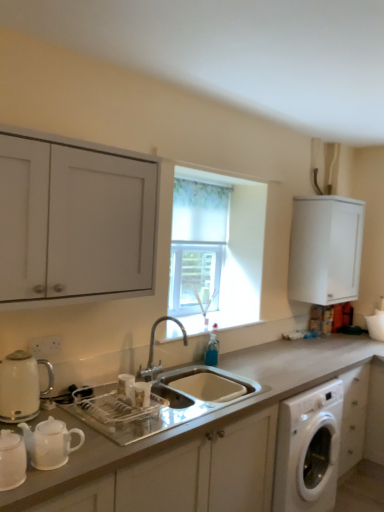
Question: Is silver metallic faucet at center behind matte white kettle at left?

Choices:
 (A) no
 (B) yes

Answer: (B)

Question: Is silver metallic faucet at center at the right side of matte white kettle at left?

Choices:
 (A) no
 (B) yes

Answer: (B)

Question: Is silver metallic faucet at center placed right next to matte white kettle at left?

Choices:
 (A) yes
 (B) no

Answer: (B)

Question: Does silver metallic faucet at center have a larger size compared to matte white kettle at left?

Choices:
 (A) no
 (B) yes

Answer: (B)

Question: Is silver metallic faucet at center not inside matte white kettle at left?

Choices:
 (A) no
 (B) yes

Answer: (B)

Question: Considering the positions of white matte cabinet at upper left, the second cabinetry when ordered from right to left, and translucent fabric curtain at center in the image, is white matte cabinet at upper left, the second cabinetry when ordered from right to left, taller or shorter than translucent fabric curtain at center?

Choices:
 (A) tall
 (B) short

Answer: (B)

Question: From the image's perspective, is white matte cabinet at upper left, the second cabinetry when ordered from right to left, located above or below translucent fabric curtain at center?

Choices:
 (A) above
 (B) below

Answer: (A)

Question: Relative to translucent fabric curtain at center, is white matte cabinet at upper left, which is counted as the first cabinetry, starting from the front, in front or behind?

Choices:
 (A) front
 (B) behind

Answer: (A)

Question: Do you think white matte cabinet at upper left, marked as the 2th cabinetry in a back-to-front arrangement, is within translucent fabric curtain at center, or outside of it?

Choices:
 (A) outside
 (B) inside

Answer: (A)

Question: From a real-world perspective, is white matte cabinet at upper right, the first cabinetry from the back, physically located above or below white matte countertop at center?

Choices:
 (A) above
 (B) below

Answer: (A)

Question: From their relative heights in the image, would you say white matte cabinet at upper right, which ranks as the 1th cabinetry in right-to-left order, is taller or shorter than white matte countertop at center?

Choices:
 (A) tall
 (B) short

Answer: (B)

Question: Is point (299, 241) closer or farther from the camera than point (226, 407)?

Choices:
 (A) farther
 (B) closer

Answer: (A)

Question: Is white matte cabinet at upper right, which ranks as the 1th cabinetry in right-to-left order, to the left or to the right of white matte countertop at center in the image?

Choices:
 (A) left
 (B) right

Answer: (B)

Question: In terms of height, does white matte countertop at center look taller or shorter compared to translucent fabric curtain at center?

Choices:
 (A) short
 (B) tall

Answer: (A)

Question: From a real-world perspective, is white matte countertop at center physically located above or below translucent fabric curtain at center?

Choices:
 (A) below
 (B) above

Answer: (A)